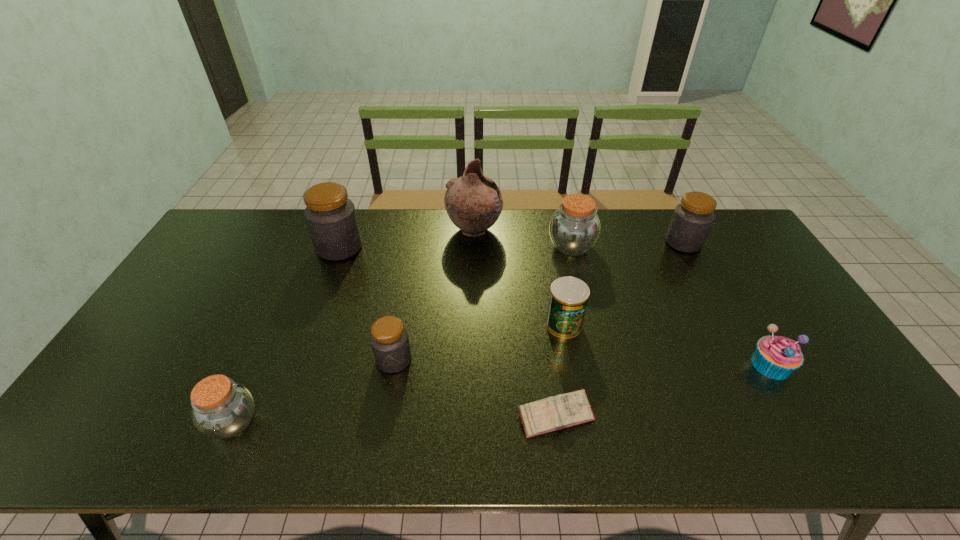
Image resolution: width=960 pixels, height=540 pixels. I want to click on object present at the right edge, so click(x=776, y=357).

Find the location of a particular element. free point at the far edge is located at coordinates (655, 243).

You are a GUI agent. You are given a task and a screenshot of the screen. Output one action in this format:
    pyautogui.click(x=<x>, y=<y>)
    Task: Click on the free spot at the near edge of the desktop
    The image size is (960, 540).
    Given the screenshot: What is the action you would take?
    pyautogui.click(x=770, y=433)

Identify the location of vacant region at the left edge of the desktop. This screenshot has width=960, height=540. (151, 353).

In the image, there is a desktop. At what (x,y) coordinates should I click in order to perform the action: click on vacant region at the right edge. Please return your answer as a coordinate pair (x, y). This screenshot has width=960, height=540. Looking at the image, I should click on (800, 368).

The width and height of the screenshot is (960, 540). I want to click on blank space at the near left corner of the desktop, so click(x=89, y=442).

In the image, there is a desktop. At what (x,y) coordinates should I click in order to perform the action: click on vacant space at the near right corner. Please return your answer as a coordinate pair (x, y). Looking at the image, I should click on (883, 449).

The width and height of the screenshot is (960, 540). I want to click on vacant area between the muffin and the shortest object, so click(x=663, y=390).

Identify the location of vacant area that lies between the smallest gray jar and the tallest jar. The width and height of the screenshot is (960, 540). (367, 303).

Locate an element on the screen. The width and height of the screenshot is (960, 540). free space between the muffin and the diary is located at coordinates (663, 390).